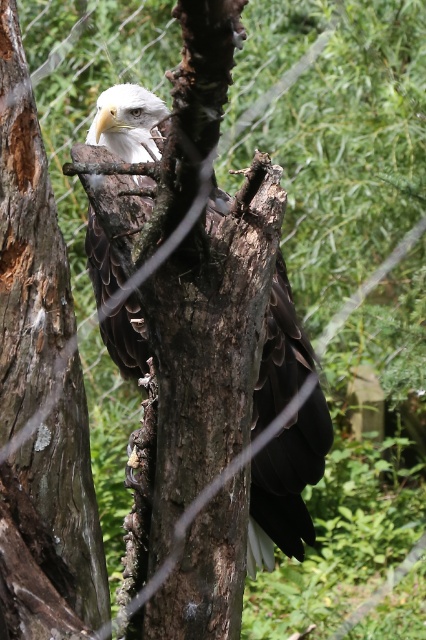
Question: Which of the following is the farthest from the observer?

Choices:
 (A) brown rough tree trunk at left
 (B) dark brown feathers at center

Answer: (B)

Question: Can you confirm if brown rough tree trunk at left is positioned to the right of dark brown feathers at center?

Choices:
 (A) yes
 (B) no

Answer: (B)

Question: Can you confirm if brown rough tree trunk at left is wider than dark brown feathers at center?

Choices:
 (A) no
 (B) yes

Answer: (A)

Question: Where is brown rough tree trunk at left located in relation to dark brown feathers at center in the image?

Choices:
 (A) right
 (B) left

Answer: (B)